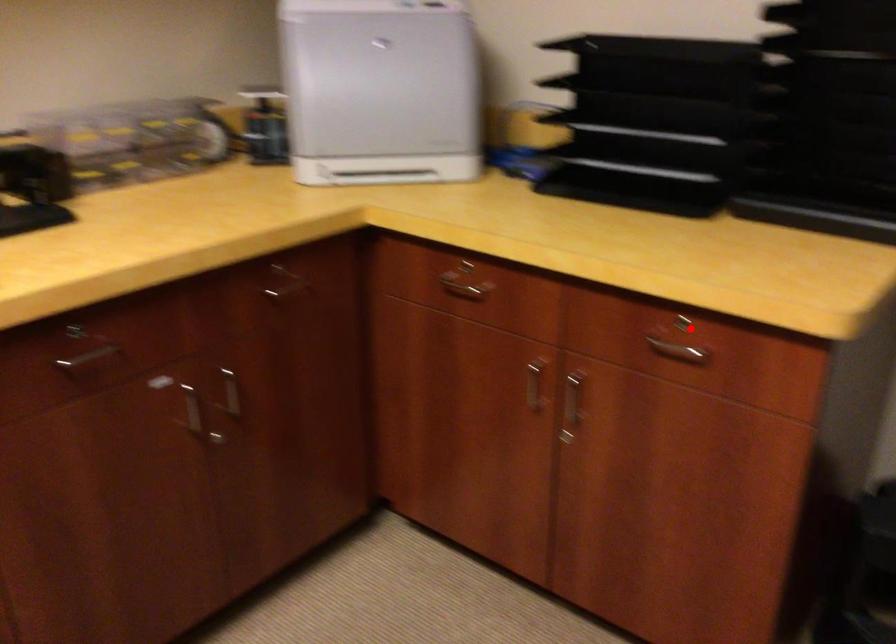
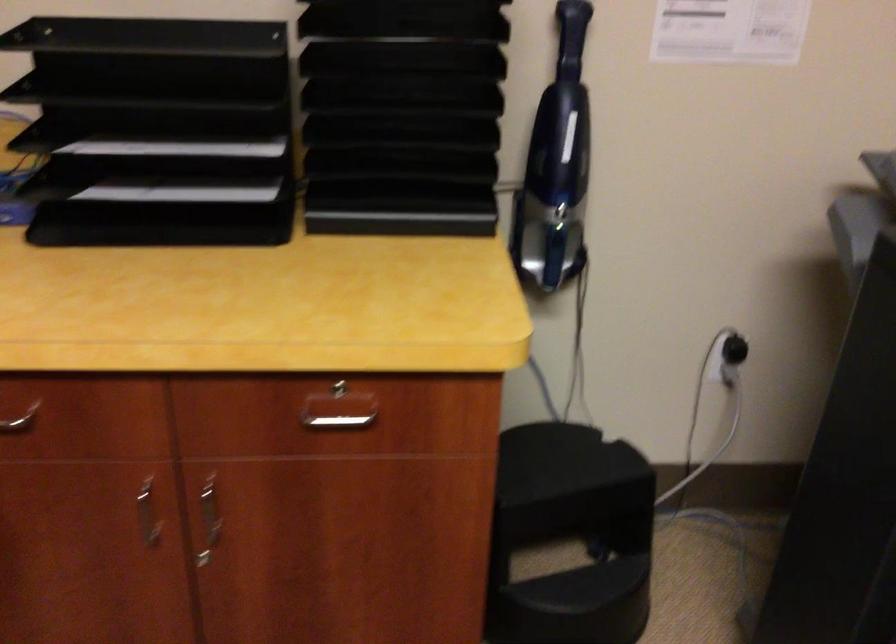
Where in the second image is the point corresponding to the highlighted location from the first image?

(342, 391)